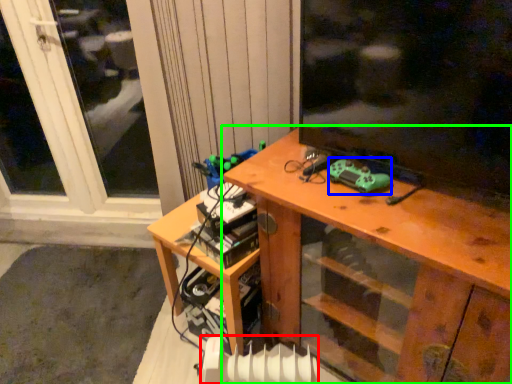
Question: Estimate the real-world distances between objects in this image. Which object is closer to radiator (highlighted by a red box), equipment (highlighted by a blue box) or desk (highlighted by a green box)?

Choices:
 (A) equipment
 (B) desk

Answer: (B)